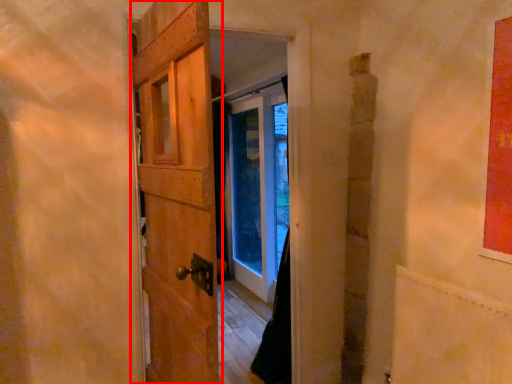
Question: Where is door (annotated by the red box) located in relation to plywood in the image?

Choices:
 (A) left
 (B) right

Answer: (A)